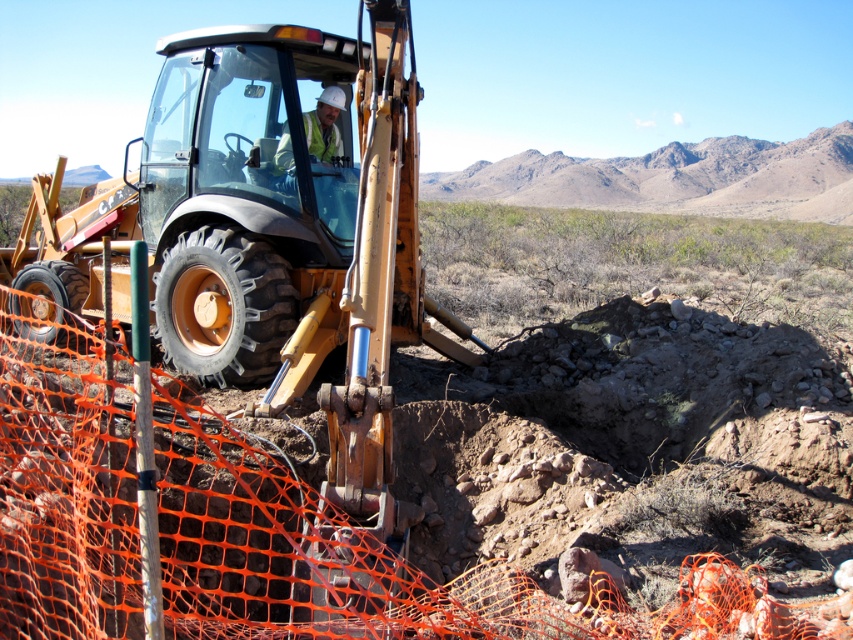
Question: In this image, where is metallic yellow tractor at center located relative to white hard hat at center?

Choices:
 (A) left
 (B) right

Answer: (B)

Question: Which object appears farthest from the camera in this image?

Choices:
 (A) metallic yellow tractor at center
 (B) white hard hat at center

Answer: (B)

Question: Among these points, which one is nearest to the camera?

Choices:
 (A) (x=310, y=132)
 (B) (x=132, y=625)

Answer: (B)

Question: Is metallic yellow tractor at center smaller than white hard hat at center?

Choices:
 (A) no
 (B) yes

Answer: (A)

Question: Does metallic yellow tractor at center have a smaller size compared to white hard hat at center?

Choices:
 (A) no
 (B) yes

Answer: (A)